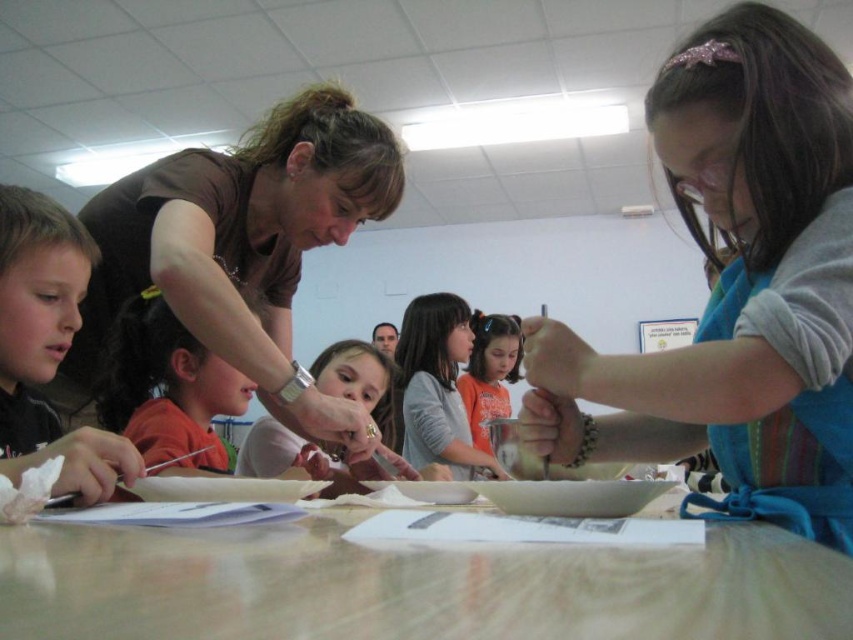
Is point (242, 145) positioned in front of point (497, 326)?

Yes, it is in front of point (497, 326).

Between brown matte shirt at upper left and orange cotton shirt at center, which one has more height?

brown matte shirt at upper left

Identify the location of brown matte shirt at upper left. (244, 244).

Is point (496, 621) positioned after point (500, 332)?

No, (496, 621) is in front of (500, 332).

Is smooth wooden table at center bigger than orange cotton shirt at center?

No, smooth wooden table at center is not bigger than orange cotton shirt at center.

The height and width of the screenshot is (640, 853). Describe the element at coordinates (410, 586) in the screenshot. I see `smooth wooden table at center` at that location.

Identify the location of smooth wooden table at center. (410, 586).

Which of these two, light brown hair at left or orange shirt at center, stands shorter?

orange shirt at center is shorter.

Does light brown hair at left appear on the right side of orange shirt at center?

Indeed, light brown hair at left is positioned on the right side of orange shirt at center.

Locate an element on the screen. light brown hair at left is located at coordinates (47, 346).

Locate an element on the screen. The width and height of the screenshot is (853, 640). light brown hair at left is located at coordinates (47, 346).